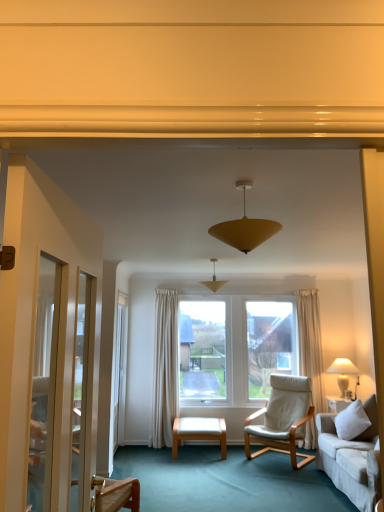
Question: Considering the relative sizes of matte yellow cone at center, acting as the 1th lamp starting from the top, and white leather ottoman at center in the image provided, is matte yellow cone at center, acting as the 1th lamp starting from the top, bigger than white leather ottoman at center?

Choices:
 (A) yes
 (B) no

Answer: (B)

Question: Are matte yellow cone at center, acting as the 1th lamp starting from the top, and white leather ottoman at center far apart?

Choices:
 (A) yes
 (B) no

Answer: (A)

Question: Is matte yellow cone at center, which is the 3th lamp in bottom-to-top order, to the right of white leather ottoman at center from the viewer's perspective?

Choices:
 (A) no
 (B) yes

Answer: (B)

Question: Is matte yellow cone at center, the 3th lamp when ordered from back to front, at the left side of white leather ottoman at center?

Choices:
 (A) yes
 (B) no

Answer: (B)

Question: From a real-world perspective, is matte yellow cone at center, which appears as the third lamp when viewed from the right, physically above white leather ottoman at center?

Choices:
 (A) no
 (B) yes

Answer: (B)

Question: From the image's perspective, would you say matte yellow cone at center, which appears as the third lamp when viewed from the right, is shown under white leather ottoman at center?

Choices:
 (A) yes
 (B) no

Answer: (B)

Question: From the image's perspective, would you say matte yellow cone at center, the second lamp viewed from the back, is shown under matte yellow cone at center, which appears as the third lamp when viewed from the right?

Choices:
 (A) no
 (B) yes

Answer: (B)

Question: Is matte yellow cone at center, the second lamp viewed from the back, facing away from matte yellow cone at center, which appears as the 1th lamp when viewed from the left?

Choices:
 (A) no
 (B) yes

Answer: (A)

Question: Would you say matte yellow cone at center, the 2th lamp viewed from the top, is outside matte yellow cone at center, which is the 1th lamp in front-to-back order?

Choices:
 (A) yes
 (B) no

Answer: (A)

Question: Does matte yellow cone at center, arranged as the 2th lamp when viewed from the front, have a greater height compared to matte yellow cone at center, which is the 3th lamp in bottom-to-top order?

Choices:
 (A) yes
 (B) no

Answer: (A)

Question: Can you confirm if matte yellow cone at center, arranged as the 2th lamp when viewed from the front, is positioned to the right of matte yellow cone at center, which appears as the third lamp when viewed from the right?

Choices:
 (A) yes
 (B) no

Answer: (A)

Question: Is matte yellow cone at center, which ranks as the second lamp in left-to-right order, bigger than matte yellow cone at center, the 3th lamp when ordered from back to front?

Choices:
 (A) yes
 (B) no

Answer: (B)

Question: Considering the relative positions of white leather ottoman at center and white fabric lampshade at right, the 1th lamp viewed from the back, in the image provided, is white leather ottoman at center to the left of white fabric lampshade at right, the 1th lamp viewed from the back, from the viewer's perspective?

Choices:
 (A) no
 (B) yes

Answer: (B)